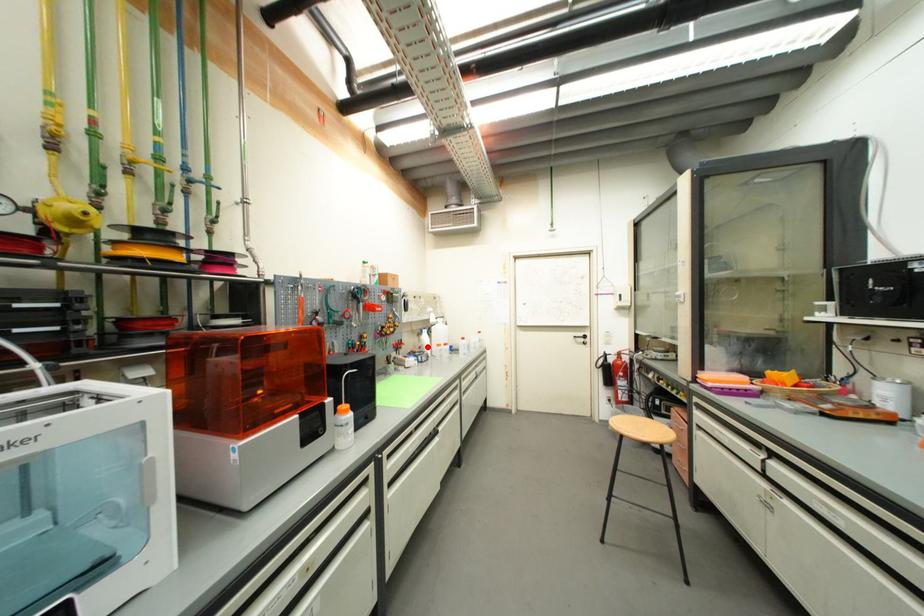
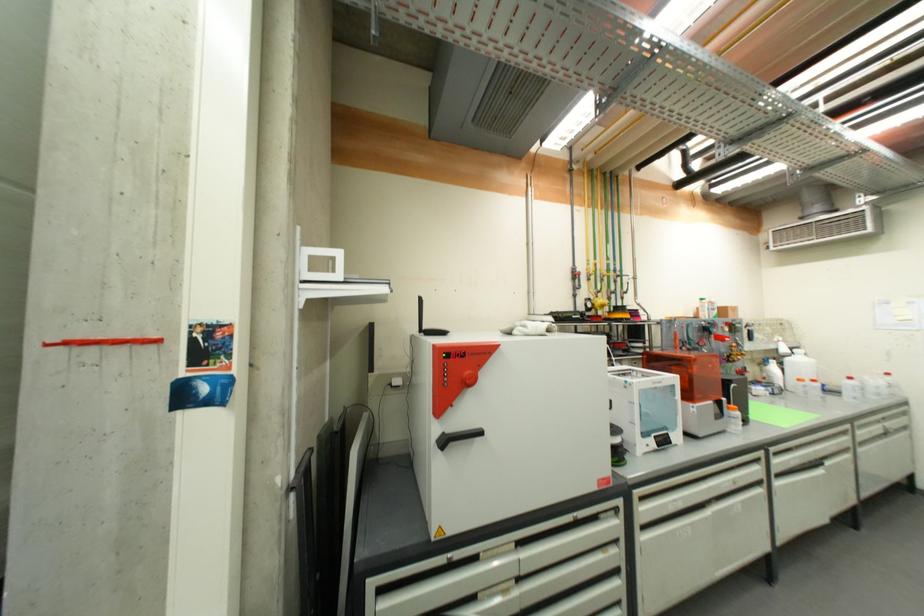
Where in the second image is the point corresponding to the highlighted location from the first image?

(774, 378)